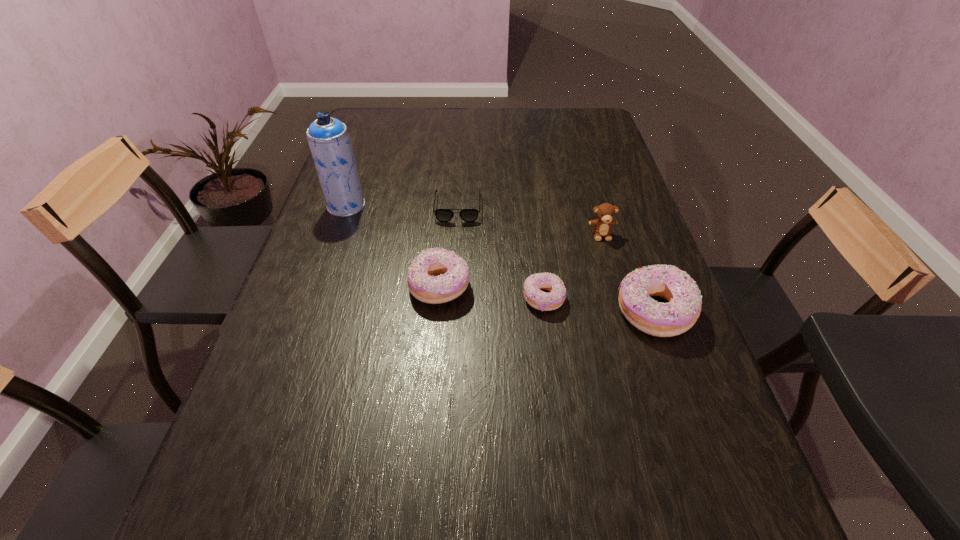
In the image, there is a desktop. Find the location of `vacant space at the right edge`. vacant space at the right edge is located at coordinates (655, 426).

The width and height of the screenshot is (960, 540). In the image, there is a desktop. What are the coordinates of `vacant space at the far left corner` in the screenshot? It's located at (395, 115).

Image resolution: width=960 pixels, height=540 pixels. What are the coordinates of `free space between the fourth nearest object and the third object from right to left` in the screenshot? It's located at (572, 266).

This screenshot has height=540, width=960. Find the location of `empty location between the third shortest object and the spectacles`. empty location between the third shortest object and the spectacles is located at coordinates (448, 247).

Where is `blank region between the third farthest object and the spectacles`? blank region between the third farthest object and the spectacles is located at coordinates (529, 221).

I want to click on unoccupied area between the second doughnut from right to left and the spectacles, so click(501, 253).

In order to click on free spot between the fourth nearest object and the rightmost doughnut in this screenshot , I will do `click(627, 273)`.

What are the coordinates of `vacant area that lies between the rightmost doughnut and the teddy bear` in the screenshot? It's located at (627, 273).

Locate an element on the screen. This screenshot has width=960, height=540. vacant area that lies between the tallest object and the spectacles is located at coordinates (402, 206).

This screenshot has height=540, width=960. Identify the location of free space between the teddy bear and the second tallest doughnut. (520, 260).